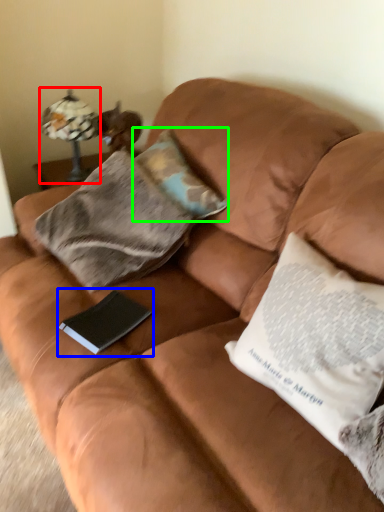
Question: Which object is positioned farthest from lamp (highlighted by a red box)? Select from paperback book (highlighted by a blue box) and pillow (highlighted by a green box).

Choices:
 (A) paperback book
 (B) pillow

Answer: (A)